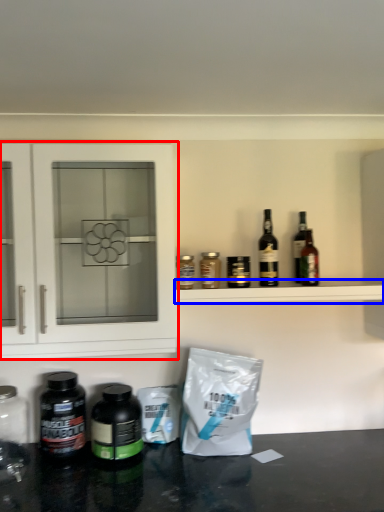
Question: Which point is closer to the camera, cabinetry (highlighted by a red box) or shelf (highlighted by a blue box)?

Choices:
 (A) cabinetry
 (B) shelf

Answer: (A)